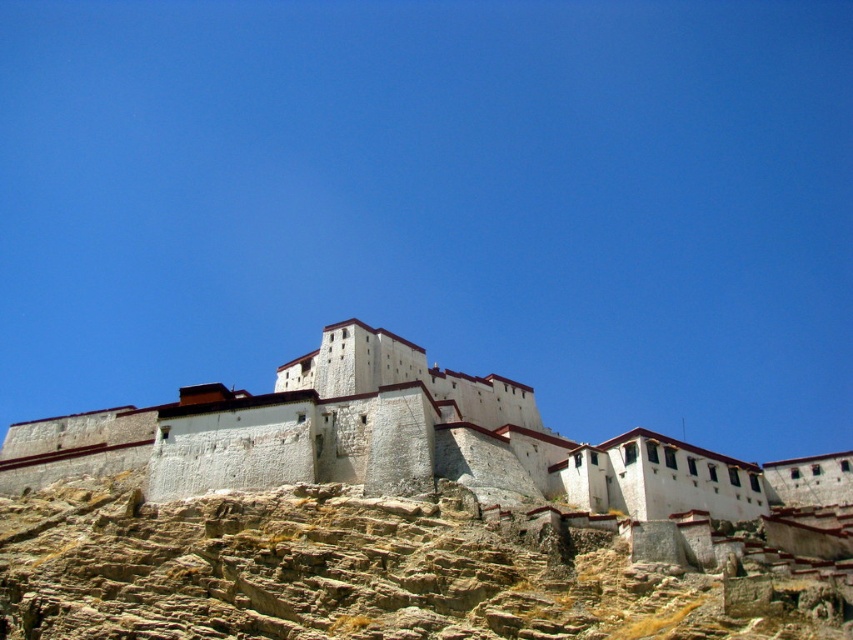
You are a traveler carrying a heavy backpack and need to reach the white stone castle at center from the brown rocky hill at lower left. The path between them is steep and rocky. Given that the distance is 60.80 feet, do you think it is feasible to walk this distance without any assistance?

The distance between the brown rocky hill at lower left and the white stone castle at center is 60.80 feet. Considering the steep and rocky terrain mentioned, walking this distance might be challenging but feasible with caution and careful steps.

You are a hiker planning to climb up the brown rocky hill at lower left and then reach the white stone castle at center. Based on the terrain details, which path would require less physical effort?

The brown rocky hill at lower left is thinner than the white stone castle at center, so climbing the brown rocky hill at lower left would require less physical effort due to its narrower width.